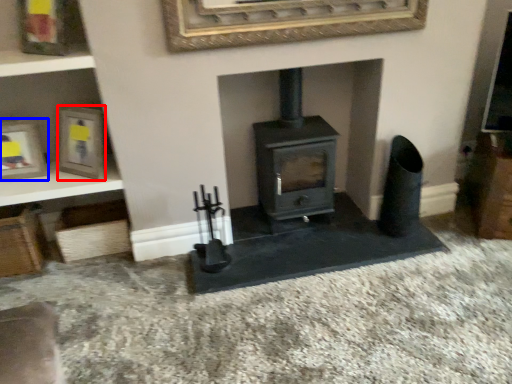
Question: Which point is further to the camera, picture frame (highlighted by a red box) or picture frame (highlighted by a blue box)?

Choices:
 (A) picture frame
 (B) picture frame

Answer: (B)